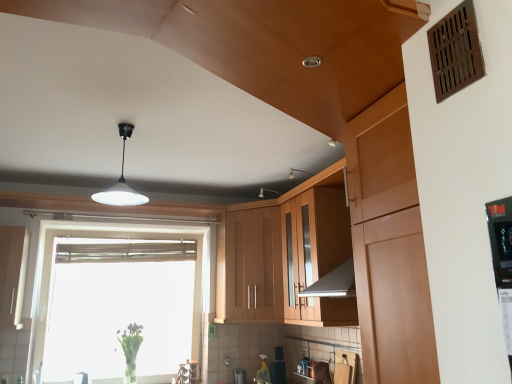
Question: Which direction should I rotate to look at wooden cabinet at center, the second cabinetry in the left-to-right sequence?

Choices:
 (A) left
 (B) right

Answer: (B)

Question: Considering the relative sizes of matte black spray bottle at lower center and white glossy cabinet at left, positioned as the 3th cabinetry in right-to-left order, in the image provided, is matte black spray bottle at lower center shorter than white glossy cabinet at left, positioned as the 3th cabinetry in right-to-left order,?

Choices:
 (A) no
 (B) yes

Answer: (B)

Question: Is matte black spray bottle at lower center at the right side of white glossy cabinet at left, which is counted as the 1th cabinetry, starting from the left?

Choices:
 (A) no
 (B) yes

Answer: (B)

Question: Can you confirm if matte black spray bottle at lower center is taller than white glossy cabinet at left, positioned as the 3th cabinetry in right-to-left order?

Choices:
 (A) no
 (B) yes

Answer: (A)

Question: Does matte black spray bottle at lower center have a larger size compared to white glossy cabinet at left, which is counted as the 1th cabinetry, starting from the left?

Choices:
 (A) yes
 (B) no

Answer: (B)

Question: Does matte black spray bottle at lower center come behind white glossy cabinet at left, which is counted as the 1th cabinetry, starting from the left?

Choices:
 (A) no
 (B) yes

Answer: (B)

Question: Is matte black spray bottle at lower center with white glossy cabinet at left, which is counted as the 1th cabinetry, starting from the left?

Choices:
 (A) yes
 (B) no

Answer: (B)

Question: Is wooden cabinet at center, which is the 2th cabinetry from right to left, positioned before transparent glass window at center?

Choices:
 (A) yes
 (B) no

Answer: (B)

Question: Does wooden cabinet at center, which is the 2th cabinetry from right to left, have a lesser width compared to transparent glass window at center?

Choices:
 (A) yes
 (B) no

Answer: (B)

Question: Does wooden cabinet at center, which is the 2th cabinetry from right to left, have a lesser height compared to transparent glass window at center?

Choices:
 (A) no
 (B) yes

Answer: (B)

Question: From the image's perspective, is wooden cabinet at center, which is the 2th cabinetry from right to left, above transparent glass window at center?

Choices:
 (A) yes
 (B) no

Answer: (A)

Question: Is wooden cabinet at center, the second cabinetry in the left-to-right sequence, at the right side of transparent glass window at center?

Choices:
 (A) no
 (B) yes

Answer: (B)

Question: Considering the relative sizes of wooden cabinet at center, the second cabinetry in the left-to-right sequence, and transparent glass window at center in the image provided, is wooden cabinet at center, the second cabinetry in the left-to-right sequence, taller than transparent glass window at center?

Choices:
 (A) yes
 (B) no

Answer: (B)

Question: Is wooden cabinet at center, placed as the first cabinetry when sorted from right to left, to the right of translucent glass vase at lower left from the viewer's perspective?

Choices:
 (A) yes
 (B) no

Answer: (A)